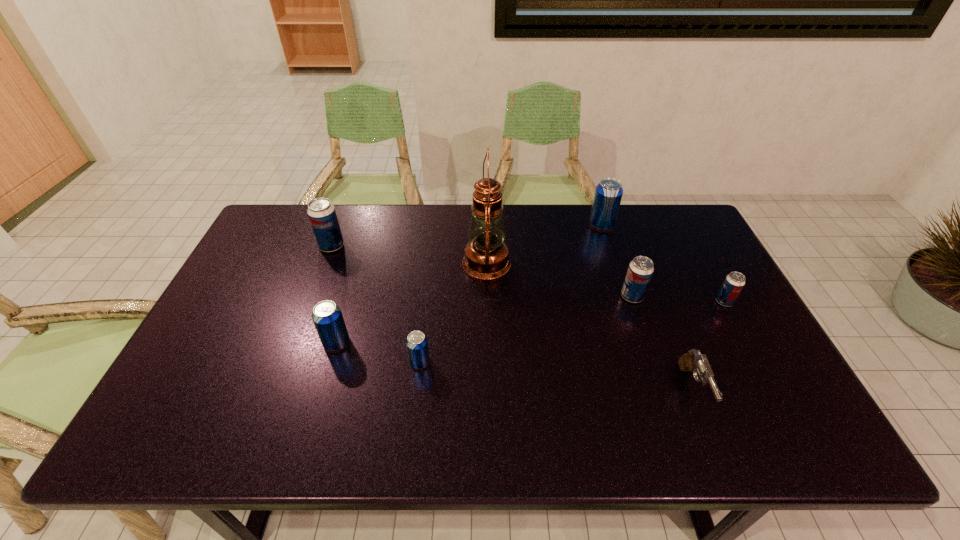
Locate an element on the screen. beer can that is the third closest to the second smallest blue beer can is located at coordinates (640, 270).

Find the location of `red beer can that is the second closest to the rightmost red beer can`. red beer can that is the second closest to the rightmost red beer can is located at coordinates (321, 212).

Locate which red beer can is the second closest to the farthest blue beer can. Please provide its 2D coordinates. Your answer should be formatted as a tuple, i.e. [(x, y)], where the tuple contains the x and y coordinates of a point satisfying the conditions above.

[(734, 282)]

Locate an element on the screen. This screenshot has width=960, height=540. blue beer can that is the nearest to the second blue beer can from left to right is located at coordinates (327, 316).

Where is `blue beer can that can be found as the closest to the second smallest red beer can`? The width and height of the screenshot is (960, 540). blue beer can that can be found as the closest to the second smallest red beer can is located at coordinates (608, 194).